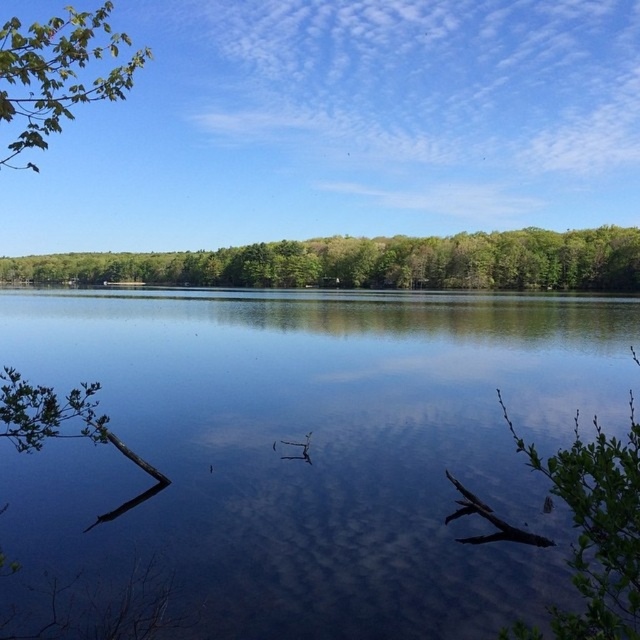
You are standing at the lakeside and notice the green leafy forest at upper center and the green leafy branch at upper left in the scene. Which one appears shorter in height?

The green leafy forest at upper center is not as tall as the green leafy branch at upper left, so the green leafy forest at upper center appears shorter in height.

You are standing at the lakeside and want to take a photo that includes both the transparent water at center and the green leafy forest at upper center. Which one of these objects will appear closer to the top of your photo?

The green leafy forest at upper center will appear closer to the top of the photo because it is taller than the transparent water at center.